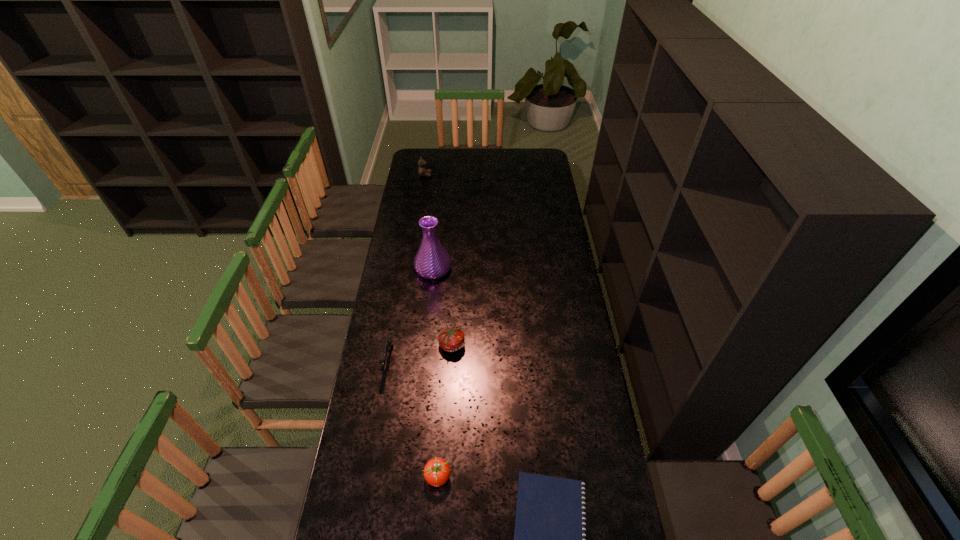
Find the location of a particular element. This screenshot has height=540, width=960. the tallest object is located at coordinates (432, 261).

The width and height of the screenshot is (960, 540). Find the location of `the fifth nearest object`. the fifth nearest object is located at coordinates (432, 261).

Find the location of `the farthest object`. the farthest object is located at coordinates (422, 170).

Where is `gun`? This screenshot has width=960, height=540. gun is located at coordinates (389, 342).

Find the location of a particular element. the farther tomato is located at coordinates (451, 339).

Locate an element on the screen. The height and width of the screenshot is (540, 960). the nearer tomato is located at coordinates (437, 471).

Where is `vacant space located on the back of the tallest object`? vacant space located on the back of the tallest object is located at coordinates (437, 232).

This screenshot has height=540, width=960. In order to click on vacant position located on the face of the teddy bear in this screenshot , I will do `click(450, 175)`.

Where is `free location located at the end of the barrel of the gun`? The width and height of the screenshot is (960, 540). free location located at the end of the barrel of the gun is located at coordinates (369, 482).

The width and height of the screenshot is (960, 540). I want to click on vacant space positioned on the front of the farther tomato, so click(x=449, y=396).